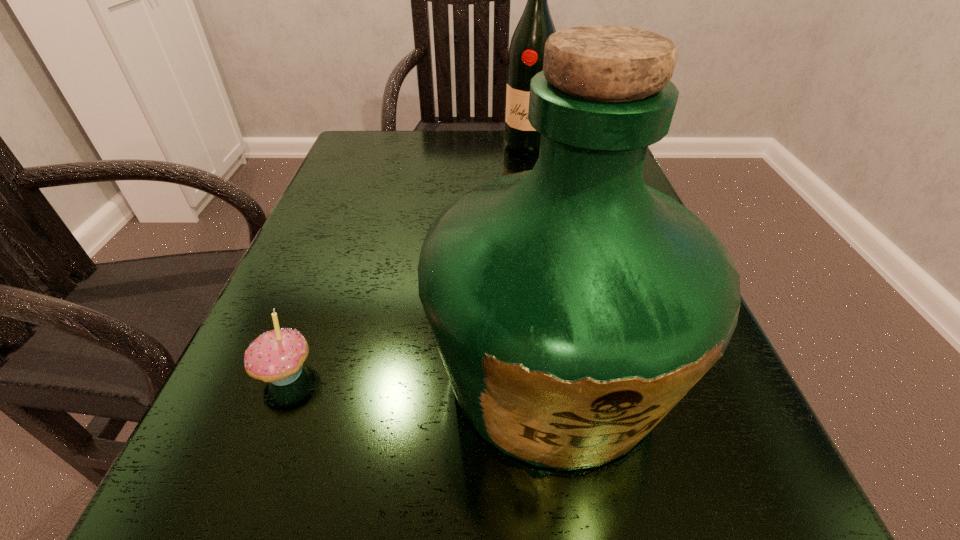
I want to click on blank region between the farthest object and the leftmost object, so click(406, 259).

Identify the location of empty space that is in between the farthest object and the leftmost object. (406, 259).

Identify the location of the closest object to the nearer liquor. (277, 356).

Identify which object is the nearest to the farthest object. Please provide its 2D coordinates. Your answer should be formatted as a tuple, i.e. [(x, y)], where the tuple contains the x and y coordinates of a point satisfying the conditions above.

[(573, 306)]